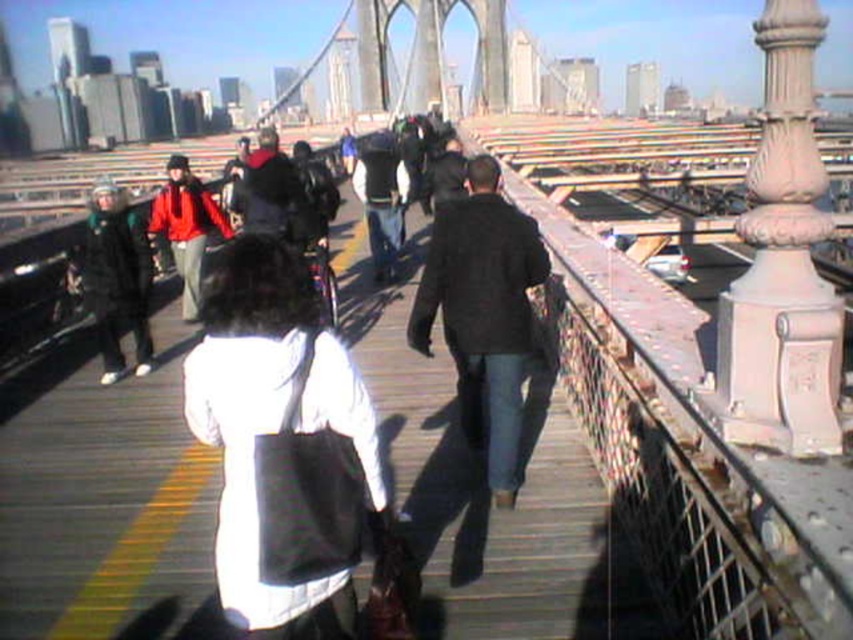
From the picture: Is wooden bridge at center thinner than black matte jacket at center?

No.

Does wooden bridge at center have a lesser height compared to black matte jacket at center?

Indeed, wooden bridge at center has a lesser height compared to black matte jacket at center.

Identify the location of wooden bridge at center. (105, 506).

From the picture: Is white matte bag at center shorter than black matte jacket at center?

Yes, white matte bag at center is shorter than black matte jacket at center.

Is white matte bag at center smaller than black matte jacket at center?

Incorrect, white matte bag at center is not smaller in size than black matte jacket at center.

Is point (305, 465) more distant than point (505, 296)?

No, (305, 465) is closer to viewer.

Image resolution: width=853 pixels, height=640 pixels. Identify the location of white matte bag at center. (282, 445).

Does white matte bag at center appear under matte red jacket at center?

Correct, white matte bag at center is located below matte red jacket at center.

Consider the image. Who is shorter, white matte bag at center or matte red jacket at center?

matte red jacket at center is shorter.

Which is in front, point (350, 358) or point (231, 230)?

Point (350, 358)

Locate an element on the screen. This screenshot has height=640, width=853. white matte bag at center is located at coordinates (282, 445).